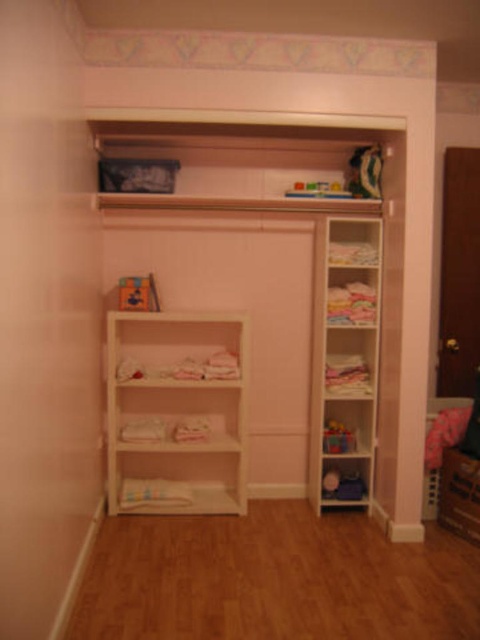
Question: Estimate the real-world distances between objects in this image. Which object is closer to the translucent plastic toy at upper center?

Choices:
 (A) wooden block at center
 (B) white wood shelves at right

Answer: (B)

Question: Observing the image, what is the correct spatial positioning of white matte bookshelf at center in reference to wooden block at center?

Choices:
 (A) above
 (B) below

Answer: (B)

Question: Which point is closer to the camera taking this photo?

Choices:
 (A) (110, 333)
 (B) (351, 184)
 (C) (370, 451)
 (D) (347, 449)

Answer: (A)

Question: Is plastic colorful toy at center above translucent plastic toy at upper center?

Choices:
 (A) no
 (B) yes

Answer: (A)

Question: Which point appears farthest from the camera in this image?

Choices:
 (A) (208, 355)
 (B) (327, 451)
 (C) (140, 288)
 (D) (380, 156)

Answer: (A)

Question: Is green plush toy at upper right in front of translucent plastic toy at upper center?

Choices:
 (A) yes
 (B) no

Answer: (A)